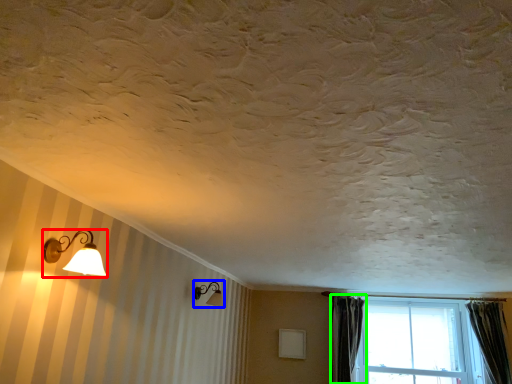
Question: Which object is the farthest from lamp (highlighted by a red box)? Choose among these: lamp (highlighted by a blue box) or curtain (highlighted by a green box).

Choices:
 (A) lamp
 (B) curtain

Answer: (B)